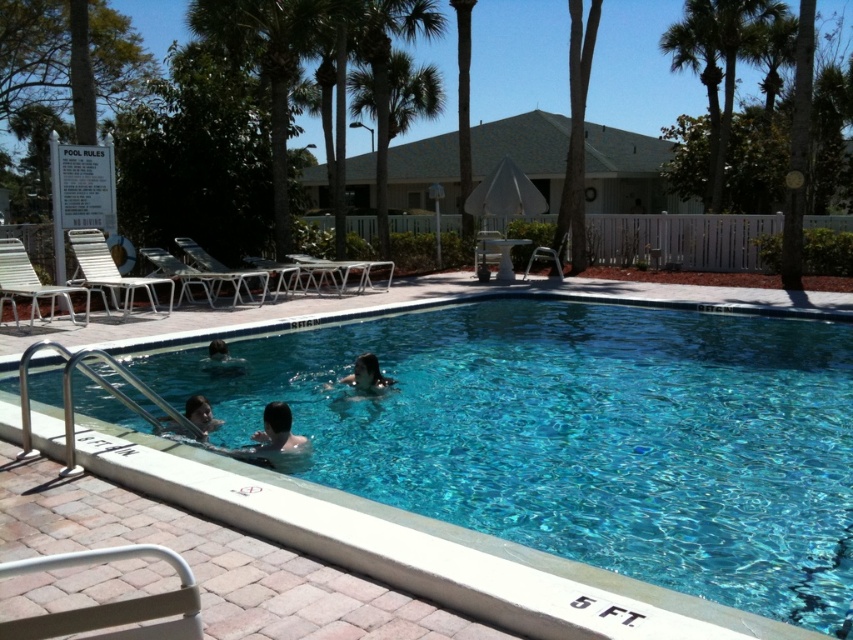
Question: Is green leafy palm tree at center positioned in front of smooth skin person at lower left?

Choices:
 (A) yes
 (B) no

Answer: (B)

Question: Does green leafy palm tree at center have a larger size compared to smooth skin person at center?

Choices:
 (A) yes
 (B) no

Answer: (A)

Question: Which object appears farthest from the camera in this image?

Choices:
 (A) smooth skin person at lower left
 (B) smooth skin person at center

Answer: (A)

Question: Estimate the real-world distances between objects in this image. Which object is farther from the dark hair at center?

Choices:
 (A) smooth skin face at lower left
 (B) green leafy palm tree at center
 (C) smooth skin person at center
 (D) clear blue water at center

Answer: (B)

Question: Is green leafy palm tree at center wider than smooth skin person at lower left?

Choices:
 (A) no
 (B) yes

Answer: (B)

Question: Estimate the real-world distances between objects in this image. Which object is farther from the green leafy palm tree at upper right?

Choices:
 (A) smooth skin person at center
 (B) clear blue water at center

Answer: (A)